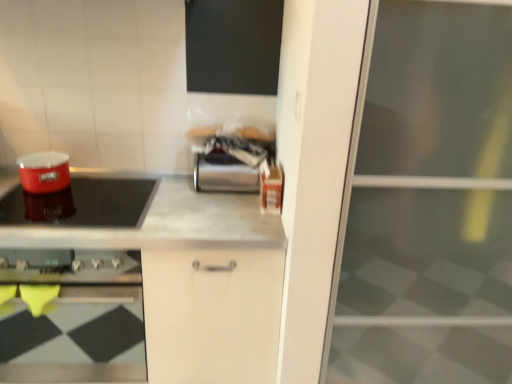
Where is `vacant area that lies between satin silver canister at center, which is the 1th appliance from right to left, and shiny red pot at left`? The image size is (512, 384). vacant area that lies between satin silver canister at center, which is the 1th appliance from right to left, and shiny red pot at left is located at coordinates (187, 200).